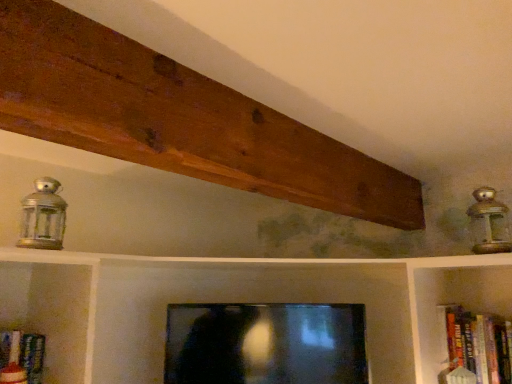
The image size is (512, 384). Describe the element at coordinates (42, 217) in the screenshot. I see `silver metallic lantern at left, which is counted as the first lamp, starting from the left` at that location.

The image size is (512, 384). What are the coordinates of `hardcover book at right` in the screenshot? It's located at (475, 347).

Image resolution: width=512 pixels, height=384 pixels. I want to click on silver metallic lantern at left, the 2th lamp positioned from the right, so click(x=42, y=217).

Which object is closer to the camera, metallic lantern at upper right, which ranks as the first lamp in right-to-left order, or silver metallic lantern at left, which is counted as the first lamp, starting from the left?

silver metallic lantern at left, which is counted as the first lamp, starting from the left, is in front.

Is metallic lantern at upper right, which is the 2th lamp in left-to-right order, outside of silver metallic lantern at left, which is counted as the first lamp, starting from the left?

metallic lantern at upper right, which is the 2th lamp in left-to-right order, lies outside silver metallic lantern at left, which is counted as the first lamp, starting from the left,'s area.

Measure the distance between metallic lantern at upper right, which is the 2th lamp in left-to-right order, and silver metallic lantern at left, which is counted as the first lamp, starting from the left.

A distance of 4.20 feet exists between metallic lantern at upper right, which is the 2th lamp in left-to-right order, and silver metallic lantern at left, which is counted as the first lamp, starting from the left.

Can you confirm if matte black tv at center is shorter than silver metallic lantern at left, the 2th lamp positioned from the right?

No.

Visually, is matte black tv at center positioned to the left or to the right of silver metallic lantern at left, the 2th lamp positioned from the right?

matte black tv at center is to the right of silver metallic lantern at left, the 2th lamp positioned from the right.

Considering the sizes of objects matte black tv at center and silver metallic lantern at left, the 2th lamp positioned from the right, in the image provided, who is bigger, matte black tv at center or silver metallic lantern at left, the 2th lamp positioned from the right,?

matte black tv at center is bigger.

Is metallic lantern at upper right, which is the 2th lamp in left-to-right order, bigger or smaller than matte black tv at center?

Considering their sizes, metallic lantern at upper right, which is the 2th lamp in left-to-right order, takes up less space than matte black tv at center.

Which is correct: metallic lantern at upper right, which ranks as the first lamp in right-to-left order, is inside matte black tv at center, or outside of it?

metallic lantern at upper right, which ranks as the first lamp in right-to-left order, is outside matte black tv at center.

From a real-world perspective, which object stands above the other?

metallic lantern at upper right, which is the 2th lamp in left-to-right order, is physically above.

Considering the positions of objects metallic lantern at upper right, which ranks as the first lamp in right-to-left order, and matte black tv at center in the image provided, who is in front, metallic lantern at upper right, which ranks as the first lamp in right-to-left order, or matte black tv at center?

Positioned in front is metallic lantern at upper right, which ranks as the first lamp in right-to-left order.

Are silver metallic lantern at left, which is counted as the first lamp, starting from the left, and hardcover book at right far apart?

Absolutely, silver metallic lantern at left, which is counted as the first lamp, starting from the left, is distant from hardcover book at right.

From the image's perspective, who appears lower, silver metallic lantern at left, the 2th lamp positioned from the right, or hardcover book at right?

hardcover book at right, from the image's perspective.

Based on the photo, do you think silver metallic lantern at left, which is counted as the first lamp, starting from the left, is within hardcover book at right, or outside of it?

silver metallic lantern at left, which is counted as the first lamp, starting from the left, is spatially situated outside hardcover book at right.

Consider the image. Is the depth of silver metallic lantern at left, which is counted as the first lamp, starting from the left, less than that of hardcover book at right?

Yes, silver metallic lantern at left, which is counted as the first lamp, starting from the left, is in front of hardcover book at right.

From the image's perspective, starting from the matte black tv at center, which lamp is the 2nd one above? Please provide its 2D coordinates.

[(42, 217)]

Is silver metallic lantern at left, which is counted as the first lamp, starting from the left, inside the boundaries of matte black tv at center, or outside?

silver metallic lantern at left, which is counted as the first lamp, starting from the left, is not inside matte black tv at center, it's outside.

Considering the relative sizes of silver metallic lantern at left, the 2th lamp positioned from the right, and matte black tv at center in the image provided, is silver metallic lantern at left, the 2th lamp positioned from the right, wider than matte black tv at center?

No, silver metallic lantern at left, the 2th lamp positioned from the right, is not wider than matte black tv at center.

From the picture: Between silver metallic lantern at left, which is counted as the first lamp, starting from the left, and matte black tv at center, which one is positioned in front?

Positioned in front is silver metallic lantern at left, which is counted as the first lamp, starting from the left.

Is silver metallic lantern at left, which is counted as the first lamp, starting from the left, not close to brown wood plank at upper center?

No.

Is the depth of silver metallic lantern at left, which is counted as the first lamp, starting from the left, less than that of brown wood plank at upper center?

No.

From the image's perspective, is silver metallic lantern at left, which is counted as the first lamp, starting from the left, over brown wood plank at upper center?

No, from the image's perspective, silver metallic lantern at left, which is counted as the first lamp, starting from the left, is not over brown wood plank at upper center.

Can you tell me how much silver metallic lantern at left, which is counted as the first lamp, starting from the left, and brown wood plank at upper center differ in facing direction?

The facing directions of silver metallic lantern at left, which is counted as the first lamp, starting from the left, and brown wood plank at upper center are 179 degrees apart.

From a real-world perspective, is brown wood plank at upper center physically located above or below silver metallic lantern at left, the 2th lamp positioned from the right?

From a real-world perspective, brown wood plank at upper center is physically above silver metallic lantern at left, the 2th lamp positioned from the right.

Is brown wood plank at upper center positioned far away from silver metallic lantern at left, the 2th lamp positioned from the right?

No.

Can you confirm if brown wood plank at upper center is smaller than silver metallic lantern at left, which is counted as the first lamp, starting from the left?

No, brown wood plank at upper center is not smaller than silver metallic lantern at left, which is counted as the first lamp, starting from the left.

From a real-world perspective, which lamp is the 2nd one underneath the brown wood plank at upper center? Please provide its 2D coordinates.

[(42, 217)]

Identify the location of lamp in front of the metallic lantern at upper right, which is the 2th lamp in left-to-right order. This screenshot has width=512, height=384. (42, 217).

From a real-world perspective, starting from the matte black tv at center, which lamp is the 1st one vertically above it? Please provide its 2D coordinates.

[(42, 217)]

Considering their positions, is metallic lantern at upper right, which ranks as the first lamp in right-to-left order, positioned closer to matte black tv at center than hardcover book at right?

The object closer to matte black tv at center is hardcover book at right.

Which object lies nearer to the anchor point brown wood plank at upper center, matte black tv at center or hardcover book at right?

matte black tv at center lies closer to brown wood plank at upper center than the other object.

Based on their spatial positions, is hardcover book at right or silver metallic lantern at left, the 2th lamp positioned from the right, closer to matte black tv at center?

hardcover book at right is closer to matte black tv at center.

From the image, which object appears to be farther from brown wood plank at upper center, silver metallic lantern at left, the 2th lamp positioned from the right, or matte black tv at center?

Based on the image, matte black tv at center appears to be further to brown wood plank at upper center.

Based on the photo, considering their positions, is silver metallic lantern at left, the 2th lamp positioned from the right, positioned closer to brown wood plank at upper center than hardcover book at right?

silver metallic lantern at left, the 2th lamp positioned from the right.

From the image, which object appears to be nearer to metallic lantern at upper right, which is the 2th lamp in left-to-right order, brown wood plank at upper center or silver metallic lantern at left, which is counted as the first lamp, starting from the left?

brown wood plank at upper center is closer to metallic lantern at upper right, which is the 2th lamp in left-to-right order.

Based on their spatial positions, is brown wood plank at upper center or matte black tv at center further from metallic lantern at upper right, which ranks as the first lamp in right-to-left order?

matte black tv at center is further to metallic lantern at upper right, which ranks as the first lamp in right-to-left order.

Based on their spatial positions, is metallic lantern at upper right, which is the 2th lamp in left-to-right order, or brown wood plank at upper center closer to silver metallic lantern at left, the 2th lamp positioned from the right?

brown wood plank at upper center lies closer to silver metallic lantern at left, the 2th lamp positioned from the right, than the other object.

Where is `plank located between silver metallic lantern at left, which is counted as the first lamp, starting from the left, and metallic lantern at upper right, which is the 2th lamp in left-to-right order, in the left-right direction`? This screenshot has width=512, height=384. plank located between silver metallic lantern at left, which is counted as the first lamp, starting from the left, and metallic lantern at upper right, which is the 2th lamp in left-to-right order, in the left-right direction is located at coordinates (178, 119).

At what (x,y) coordinates should I click in order to perform the action: click on lamp situated between matte black tv at center and hardcover book at right from left to right. Please return your answer as a coordinate pair (x, y). Looking at the image, I should click on (489, 223).

Locate an element on the screen. Image resolution: width=512 pixels, height=384 pixels. plank between silver metallic lantern at left, the 2th lamp positioned from the right, and hardcover book at right from left to right is located at coordinates (178, 119).

Where is `lamp between silver metallic lantern at left, the 2th lamp positioned from the right, and hardcover book at right`? This screenshot has width=512, height=384. lamp between silver metallic lantern at left, the 2th lamp positioned from the right, and hardcover book at right is located at coordinates (489, 223).